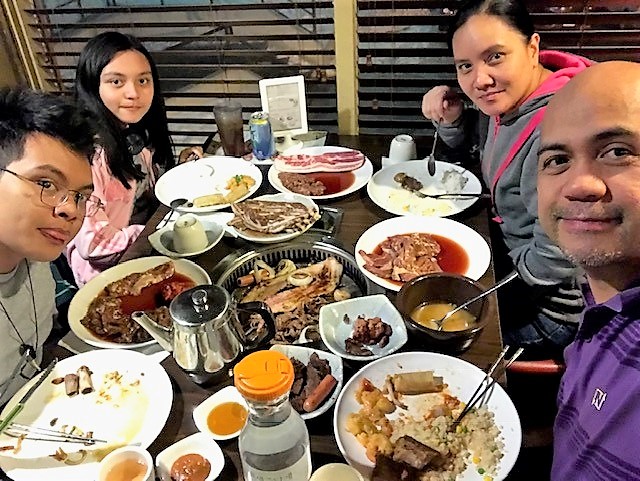
Locate an element on the screen. The image size is (640, 481). teapot is located at coordinates pyautogui.click(x=208, y=348).